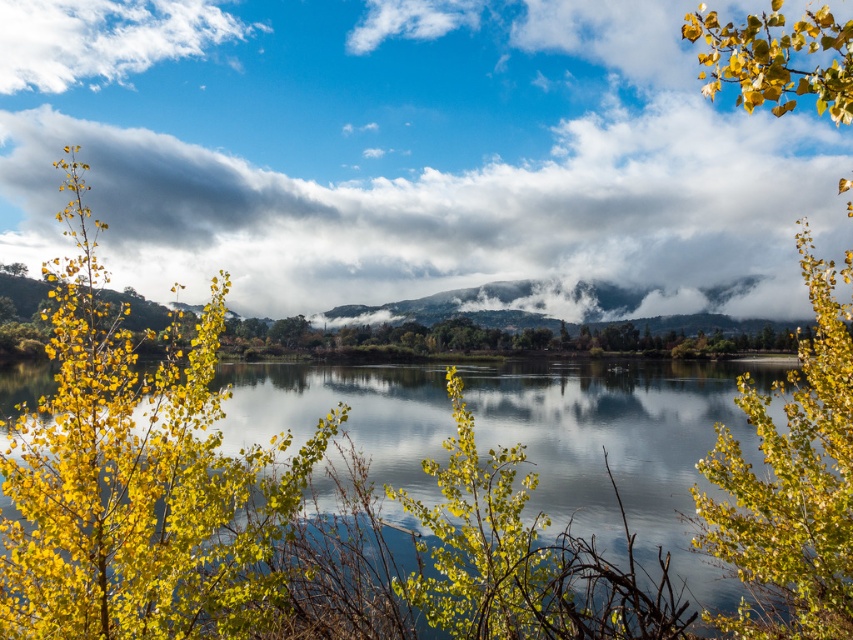
You are standing at the point with coordinates point (x=751, y=417) and want to walk to the point with coordinates point (x=474, y=609). Is the destination point behind you or in front of you?

The destination point (x=474, y=609) is behind the starting point (x=751, y=417), so it is behind you.

You are standing at the edge of the water and notice the cloudy sky at upper center and the yellow leafy tree at left. Which one appears to cover more of the scene horizontally?

The cloudy sky at upper center might be wider than yellow leafy tree at left according to the description.

You are standing at the lakeside and looking up at the cloudy sky at upper center and the white fluffy cloud at upper left. Which one is closer to the water surface?

The cloudy sky at upper center is located below the white fluffy cloud at upper left, so the cloudy sky at upper center is closer to the water surface.